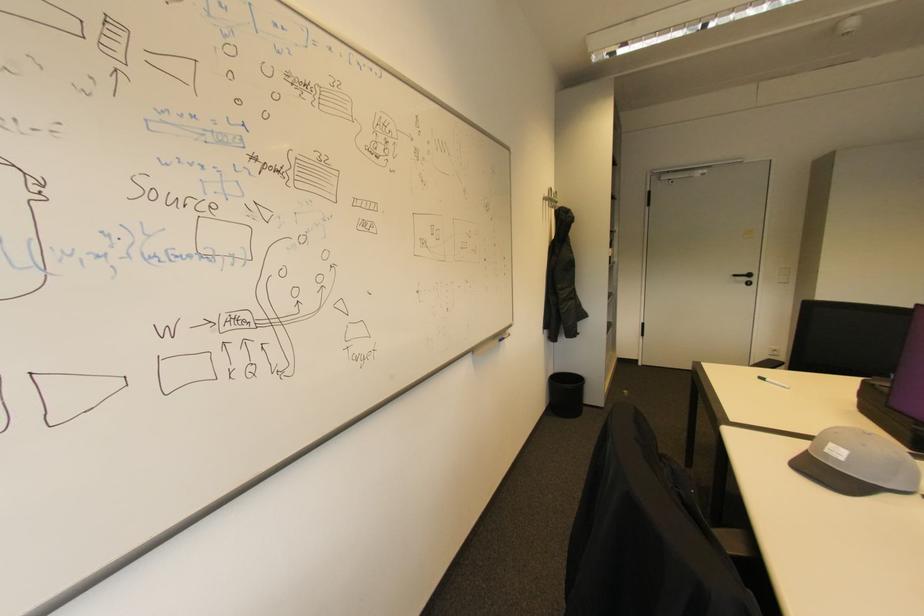
Find where to plac the whiteboard marker tray. Please return your answer as a coordinate pair (x, y).

(496, 339)